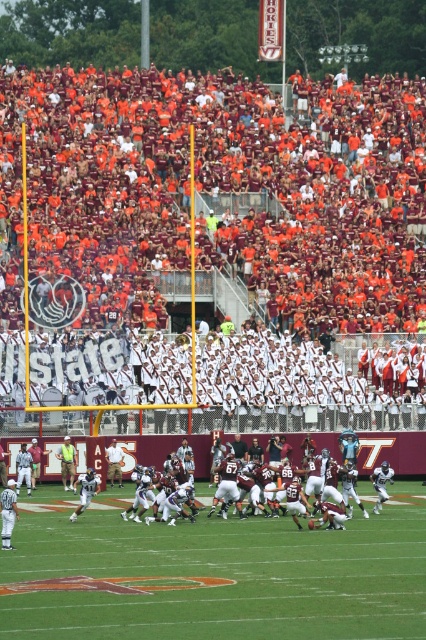
Is maroon fabric seats at upper center positioned at the back of green grass football field at center?

Yes, maroon fabric seats at upper center is further from the viewer.

Is point (316, 163) in front of point (408, 512)?

No, (316, 163) is behind (408, 512).

Is point (293, 163) behind point (60, 538)?

Yes, point (293, 163) is behind point (60, 538).

You are a GUI agent. You are given a task and a screenshot of the screen. Output one action in this format:
    pyautogui.click(x=<x>, y=<y>)
    Task: Click on the maroon fabric seats at upper center
    The height and width of the screenshot is (640, 426).
    Given the screenshot: What is the action you would take?
    pyautogui.click(x=212, y=253)

Is green grass football field at center to the left of maroon uniformed players at center from the viewer's perspective?

Yes, green grass football field at center is to the left of maroon uniformed players at center.

Looking at this image, is green grass football field at center behind maroon uniformed players at center?

No.

Who is more forward, (265, 624) or (368, 472)?

Positioned in front is point (265, 624).

I want to click on green grass football field at center, so click(x=218, y=577).

Does maroon fabric seats at upper center have a larger size compared to maroon uniformed players at center?

Yes.

Who is positioned more to the right, maroon fabric seats at upper center or maroon uniformed players at center?

maroon uniformed players at center

Which is in front, point (204, 182) or point (210, 442)?

Point (210, 442)

The image size is (426, 640). Find the location of `maroon fabric seats at upper center`. maroon fabric seats at upper center is located at coordinates (212, 253).